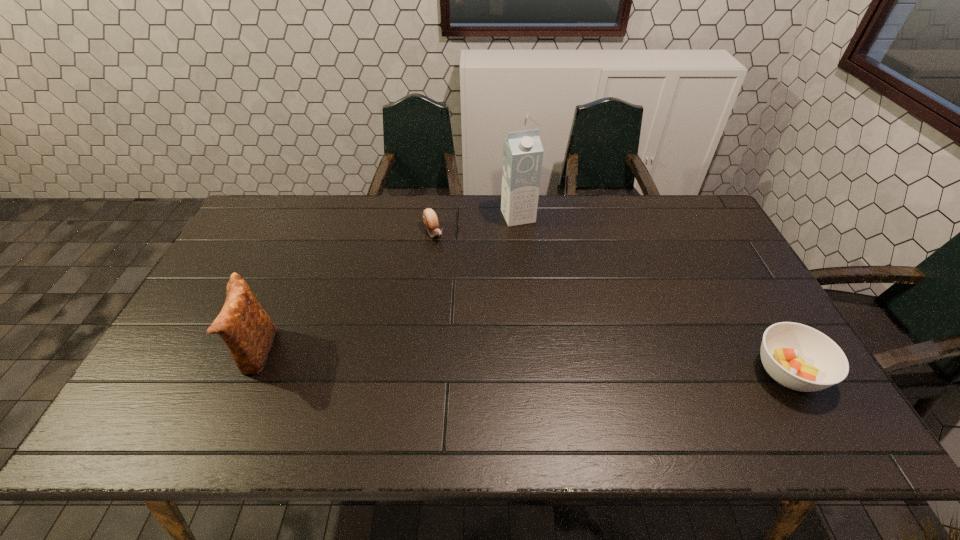
Find the location of a particular element. The image size is (960, 540). free point located on the back of the rightmost object is located at coordinates (740, 290).

The image size is (960, 540). I want to click on free space located 0.100m on the front label of the second object from right to left, so coord(533,246).

Identify the location of vacant region located on the front label of the second object from right to left. (564, 310).

The width and height of the screenshot is (960, 540). In order to click on vacant position located 0.290m on the front label of the second object from right to left in this screenshot , I will do `click(553, 287)`.

At what (x,y) coordinates should I click in order to perform the action: click on free spot located 0.070m on the front-facing side of the shortest object. Please return your answer as a coordinate pair (x, y). Looking at the image, I should click on (446, 256).

Identify the location of free location located on the front-facing side of the shortest object. click(x=457, y=272).

You are a GUI agent. You are given a task and a screenshot of the screen. Output one action in this format:
    pyautogui.click(x=<x>, y=<y>)
    Task: Click on the free region located 0.230m on the front-facing side of the shortest object
    Image resolution: width=960 pixels, height=540 pixels.
    Given the screenshot: What is the action you would take?
    pyautogui.click(x=468, y=289)

Find the location of a particular element. The image size is (960, 540). carton situated at the far edge is located at coordinates (522, 152).

The height and width of the screenshot is (540, 960). I want to click on escargot located in the far edge section of the desktop, so click(430, 219).

At what (x,y) coordinates should I click in order to perform the action: click on clutch bag positioned at the near edge. Please return your answer as a coordinate pair (x, y). The image size is (960, 540). Looking at the image, I should click on (245, 327).